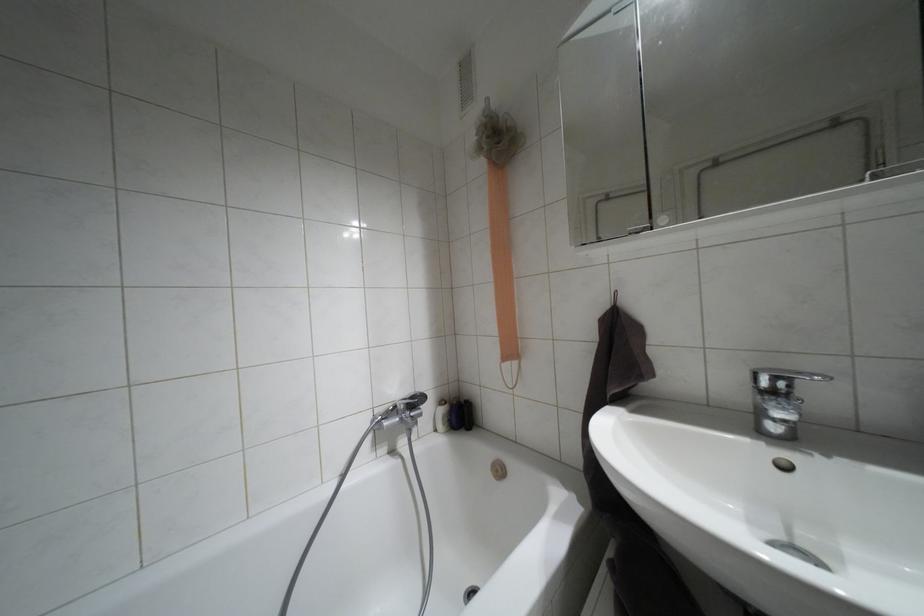
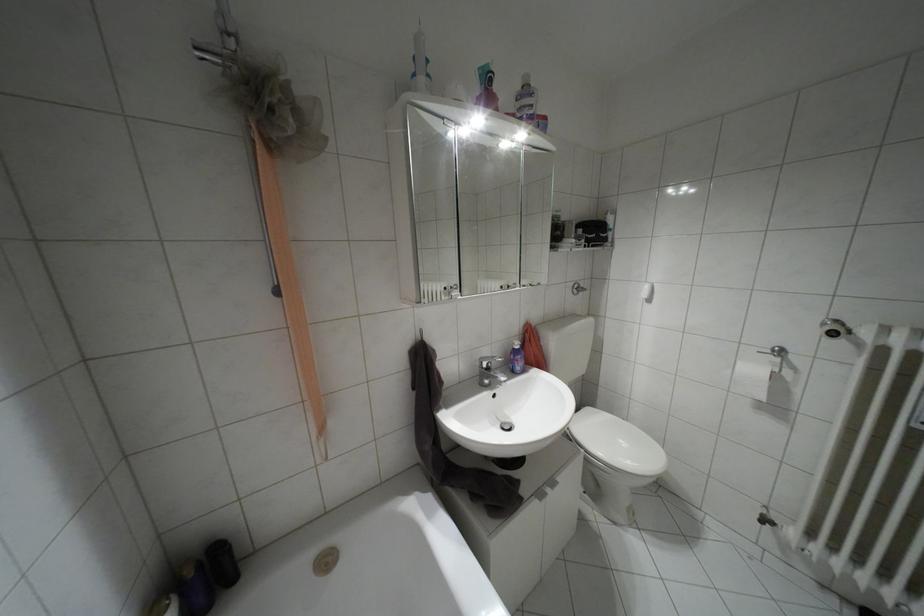
Question: How did the camera likely rotate?

Choices:
 (A) Left
 (B) Right
 (C) Up
 (D) Down

Answer: (B)